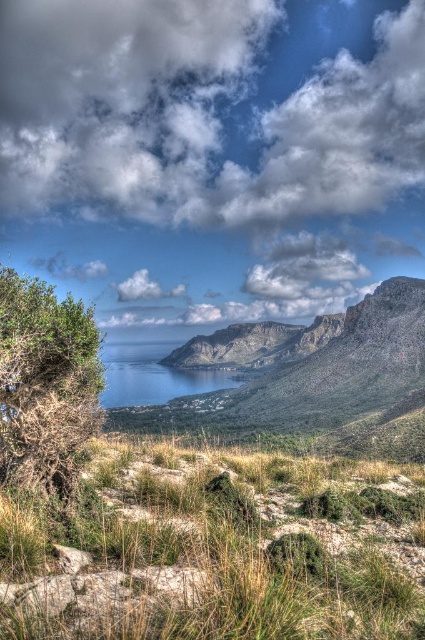
You are a hiker who wants to cross the valley to reach the coast. You see a green leafy bush at left and blue water at center. Which object is shorter in height?

The green leafy bush at left is not as tall as the blue water at center, so the green leafy bush at left is shorter in height.

You are standing at the point closer to the camera in the image. Which point are you at, point (79, 512) or point (133, 332)?

You are at point (79, 512) because it is closer to the camera than point (133, 332).

You are standing at the origin point of the image, which is the bottom left corner. The green grassy area is located at coordinates 0.858 on the x and 0.508 on the y axis. If you want to reach the green grassy at lower center, which direction should you move from your current position?

To reach the green grassy at lower center from the origin point at the bottom left corner, you should move towards the right and slightly upwards since its coordinates are 0.858 on the x and 0.508 on the y axis.